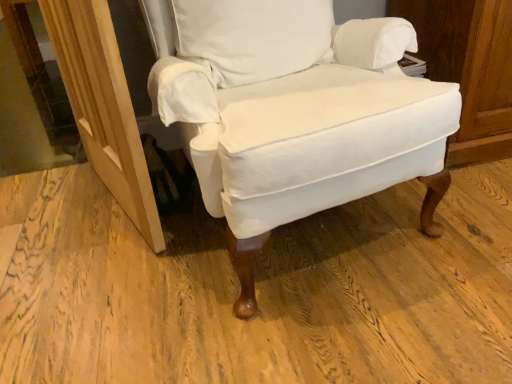
Question: From a real-world perspective, is white fabric chair at center on white cotton pillow at center?

Choices:
 (A) yes
 (B) no

Answer: (B)

Question: Can we say white fabric chair at center lies outside white cotton pillow at center?

Choices:
 (A) no
 (B) yes

Answer: (B)

Question: Can you confirm if white fabric chair at center is taller than white cotton pillow at center?

Choices:
 (A) yes
 (B) no

Answer: (A)

Question: Is white fabric chair at center closer to camera compared to white cotton pillow at center?

Choices:
 (A) yes
 (B) no

Answer: (A)

Question: From a real-world perspective, is white fabric chair at center physically below white cotton pillow at center?

Choices:
 (A) yes
 (B) no

Answer: (A)

Question: Is white cotton pillow at center in front of or behind wooden screen door at lower left in the image?

Choices:
 (A) front
 (B) behind

Answer: (B)

Question: Is white cotton pillow at center inside or outside of wooden screen door at lower left?

Choices:
 (A) outside
 (B) inside

Answer: (A)

Question: From their relative heights in the image, would you say white cotton pillow at center is taller or shorter than wooden screen door at lower left?

Choices:
 (A) short
 (B) tall

Answer: (A)

Question: From a real-world perspective, relative to wooden screen door at lower left, is white cotton pillow at center vertically above or below?

Choices:
 (A) below
 (B) above

Answer: (B)

Question: Relative to wooden screen door at lower left, is white fabric chair at center in front or behind?

Choices:
 (A) front
 (B) behind

Answer: (A)

Question: From a real-world perspective, is white fabric chair at center above or below wooden screen door at lower left?

Choices:
 (A) below
 (B) above

Answer: (B)

Question: Is white fabric chair at center bigger or smaller than wooden screen door at lower left?

Choices:
 (A) small
 (B) big

Answer: (B)

Question: Is white fabric chair at center wider or thinner than wooden screen door at lower left?

Choices:
 (A) wide
 (B) thin

Answer: (A)

Question: Does point (117, 132) appear closer or farther from the camera than point (309, 135)?

Choices:
 (A) closer
 (B) farther

Answer: (B)

Question: Looking at the image, does wooden screen door at lower left seem bigger or smaller compared to white fabric chair at center?

Choices:
 (A) big
 (B) small

Answer: (B)